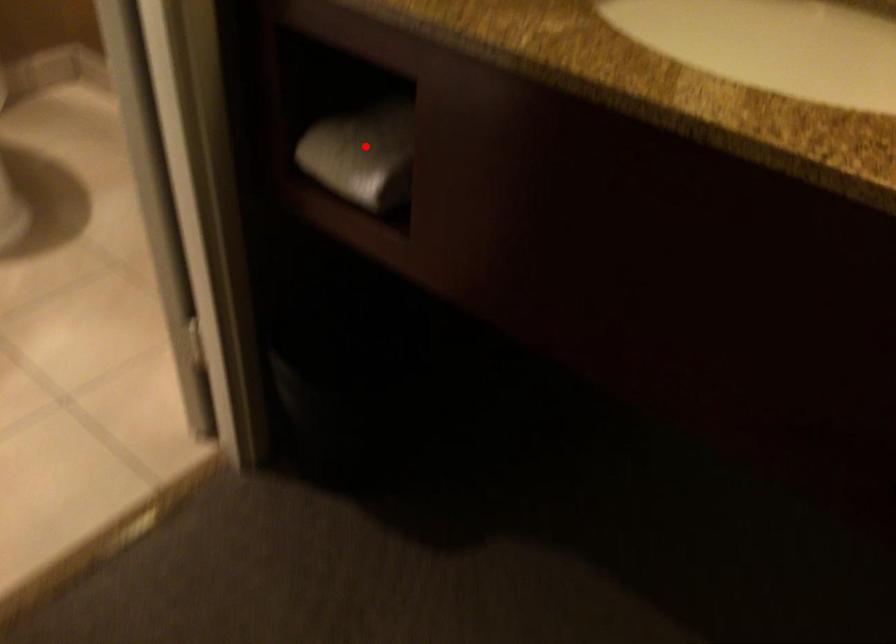
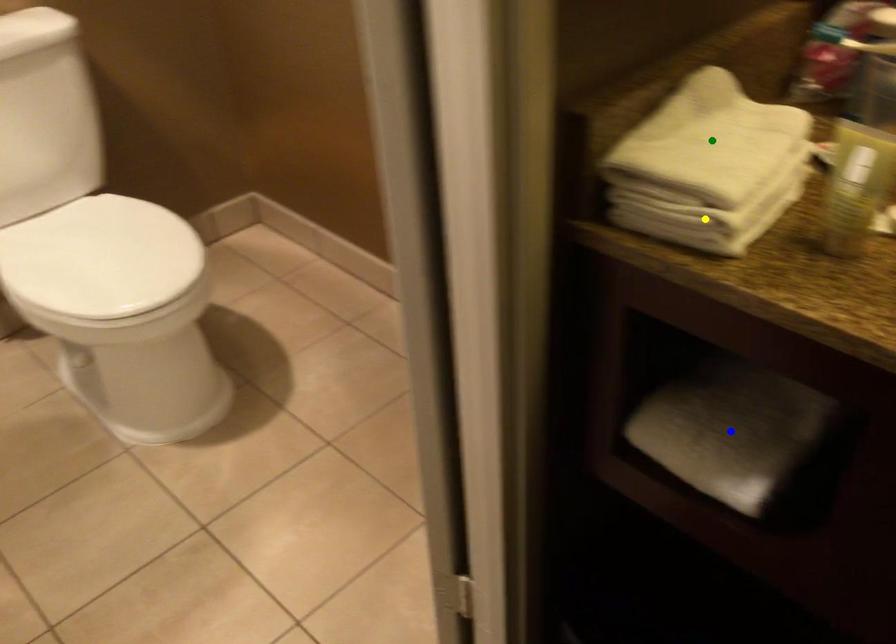
Question: I am providing you with two images of the same scene from different viewpoints. A red point is marked on the first image. You are given multiple points on the second image. Which point in image 2 is actually the same real-world point as the red point in image 1?

Choices:
 (A) blue point
 (B) green point
 (C) yellow point

Answer: (A)